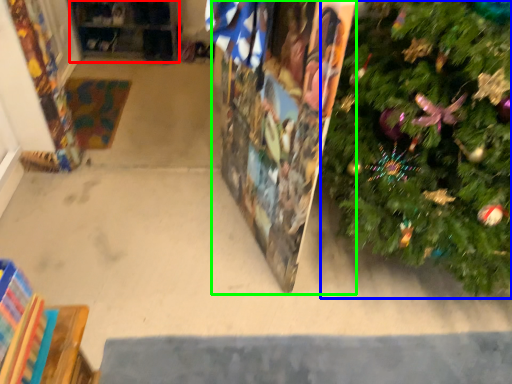
Question: Which object is positioned closest to shelf (highlighted by a red box)? Select from christmas tree (highlighted by a blue box) and bulletin board (highlighted by a green box).

Choices:
 (A) christmas tree
 (B) bulletin board

Answer: (B)